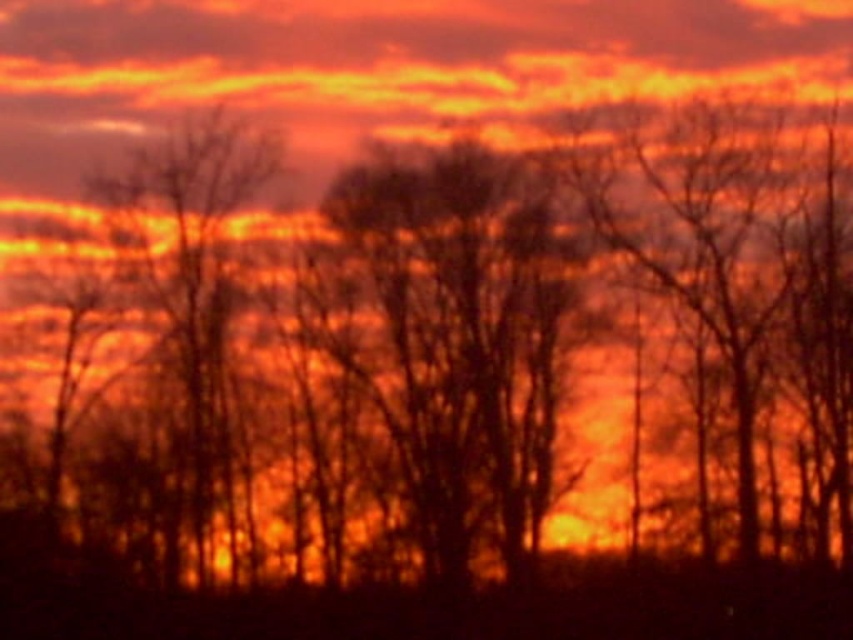
You are an artist trying to capture this sunset scene. You notice the silhouette tree at center and the matte orange cloud at upper center. According to the scene, which object is positioned to the right of the other?

The silhouette tree at center is positioned to the right of the matte orange cloud at upper center.

You are an artist planning to paint the sunset scene. You want to ensure the silhouette tree at center is not wider than the matte orange cloud at upper center in your painting. Based on the scene, will this requirement be naturally satisfied?

Yes, the silhouette tree at center is naturally narrower than the matte orange cloud at upper center, so the requirement will be satisfied.

You are an artist standing 30 feet away from the silhouette tree at center. You want to paint the matte orange cloud at upper center in your painting. Can you reach the cloud in your field of view without moving closer to the tree?

The silhouette tree at center is 28.29 feet away from the matte orange cloud at upper center. Since you are already 30 feet away from the silhouette tree at center, which is farther than the distance between the tree and the cloud, the cloud would be slightly behind your current position. Therefore, you might not be able to see the matte orange cloud at upper center clearly without moving closer to the tree.